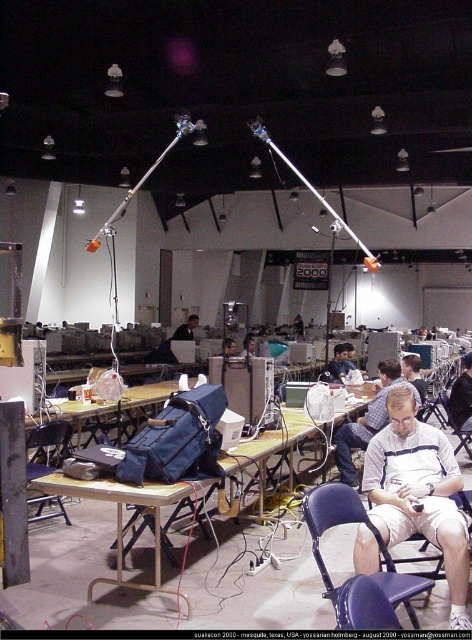
Question: Is white striped shirt at center closer to camera compared to blue plastic chair at lower center?

Choices:
 (A) yes
 (B) no

Answer: (B)

Question: Does metallic silver table at center appear on the right side of matte black laptop at center?

Choices:
 (A) yes
 (B) no

Answer: (A)

Question: Which point is farther to the camera?

Choices:
 (A) blue fabric chair at lower right
 (B) white striped shirt at center
 (C) metallic silver table at center
 (D) matte black chair at lower left

Answer: (A)

Question: Which of the following is the closest to the observer?

Choices:
 (A) (405, 609)
 (B) (448, 420)
 (C) (208, 481)
 (D) (52, 465)

Answer: (A)

Question: Which point appears closest to the camera in this image?

Choices:
 (A) (119, 493)
 (B) (368, 422)
 (C) (315, 540)

Answer: (C)

Question: Is matte black chair at lower left positioned behind matte black laptop at center?

Choices:
 (A) yes
 (B) no

Answer: (B)